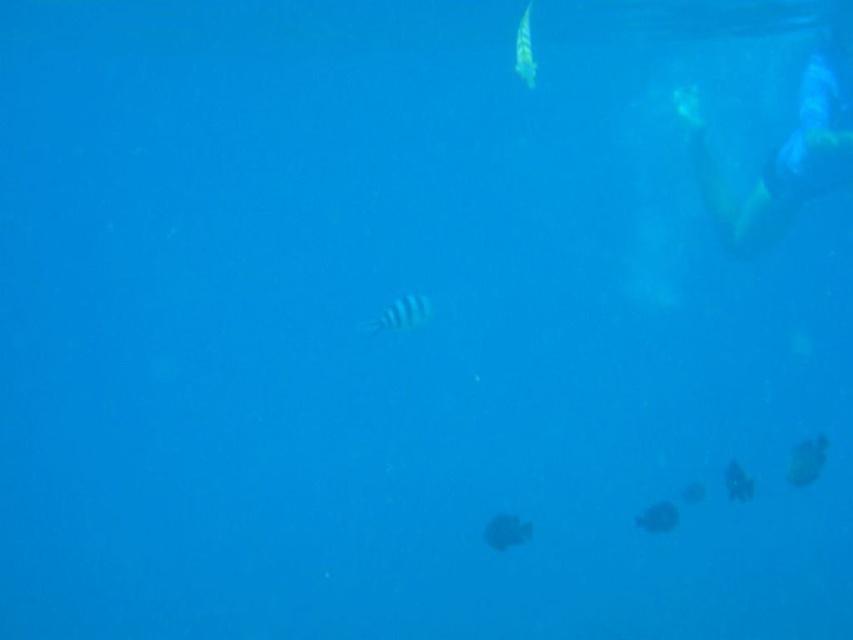
You are an underwater photographer trying to capture both the blue striped fish at center and the smooth gray fish at lower right in a single shot. Based on their sizes, which fish should you focus on first to ensure both fit in the frame?

The blue striped fish at center is larger than the smooth gray fish at lower right, so you should focus on positioning the larger fish first to ensure both fit within the frame.

You are an underwater photographer aiming to capture both the blue striped fish at center and the smooth gray fish at lower right in a single shot. Based on their positions, which fish should you adjust your camera to focus on first to ensure both are in frame?

The blue striped fish at center is positioned on the left side of the smooth gray fish at lower right. To capture both in a single shot, you should focus on the blue striped fish at center first, as it is closer to the center of the frame, allowing easier adjustment to include the smooth gray fish at lower right.

You are underwater and see the blue striped fish at center and the smooth gray fish at lower right. Which fish is closer to the surface?

The blue striped fish at center is closer to the surface because it is positioned above the smooth gray fish at lower right.